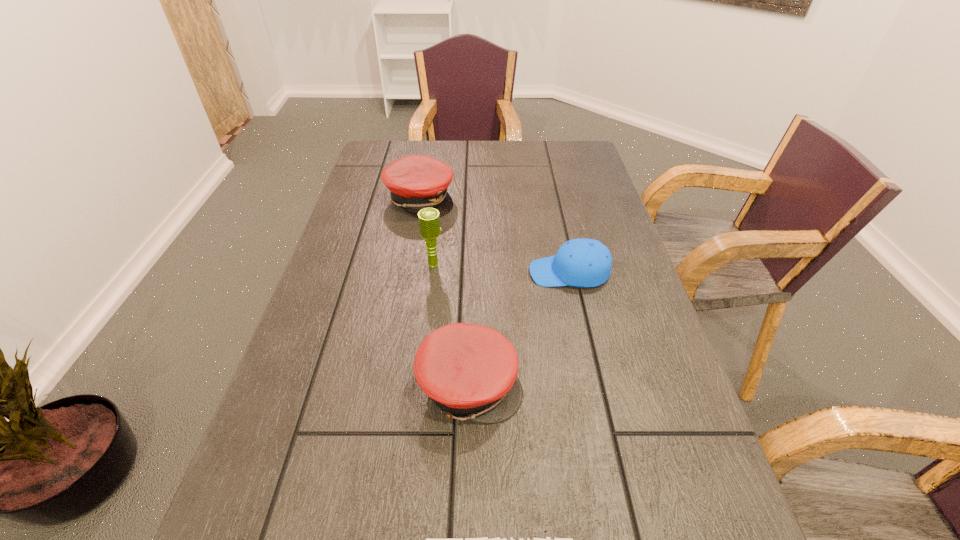
The height and width of the screenshot is (540, 960). I want to click on the tallest object, so click(429, 221).

This screenshot has height=540, width=960. What are the coordinates of `the farthest object` in the screenshot? It's located at (416, 182).

Where is `the third farthest cap`? Image resolution: width=960 pixels, height=540 pixels. the third farthest cap is located at coordinates (469, 371).

This screenshot has width=960, height=540. Identify the location of the second farthest cap. (581, 262).

Identify the location of free space located on the front of the tallest object. The height and width of the screenshot is (540, 960). (428, 315).

Identify the location of vacant space located at the front of the farthest cap where the visor is located. The image size is (960, 540). (x=525, y=199).

Where is `free spot located on the front of the second nearest object with an emblem`? free spot located on the front of the second nearest object with an emblem is located at coordinates click(665, 386).

This screenshot has height=540, width=960. Find the location of `free space located 0.210m on the front-facing side of the third nearest cap`. free space located 0.210m on the front-facing side of the third nearest cap is located at coordinates (443, 273).

You are a GUI agent. You are given a task and a screenshot of the screen. Output one action in this format:
    pyautogui.click(x=<x>, y=<y>)
    Task: Click on the free space located 0.300m on the front-facing side of the third nearest cap
    This screenshot has height=540, width=960.
    Given the screenshot: What is the action you would take?
    pyautogui.click(x=405, y=273)

The width and height of the screenshot is (960, 540). I want to click on free location located 0.220m on the front-facing side of the third nearest cap, so click(439, 273).